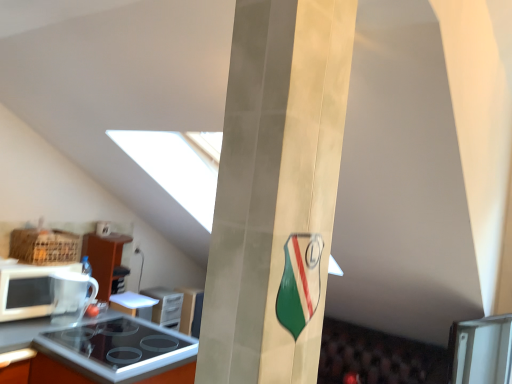
Question: Is the depth of orange laminate countertop at lower left greater than that of matte gold pillar at center?

Choices:
 (A) yes
 (B) no

Answer: (A)

Question: From a real-world perspective, is orange laminate countertop at lower left over matte gold pillar at center?

Choices:
 (A) yes
 (B) no

Answer: (B)

Question: From the image's perspective, is orange laminate countertop at lower left on matte gold pillar at center?

Choices:
 (A) yes
 (B) no

Answer: (B)

Question: Is orange laminate countertop at lower left taller than matte gold pillar at center?

Choices:
 (A) yes
 (B) no

Answer: (B)

Question: Is matte gold pillar at center completely or partially inside orange laminate countertop at lower left?

Choices:
 (A) no
 (B) yes

Answer: (A)

Question: Is matte gold pillar at center taller or shorter than orange laminate countertop at lower left?

Choices:
 (A) tall
 (B) short

Answer: (A)

Question: From a real-world perspective, is matte gold pillar at center physically located above or below orange laminate countertop at lower left?

Choices:
 (A) below
 (B) above

Answer: (B)

Question: Considering the positions of matte gold pillar at center and orange laminate countertop at lower left in the image, is matte gold pillar at center bigger or smaller than orange laminate countertop at lower left?

Choices:
 (A) big
 (B) small

Answer: (B)

Question: Considering their positions, is matte gold pillar at center located in front of or behind orange laminate countertop at lower left?

Choices:
 (A) front
 (B) behind

Answer: (A)

Question: In terms of size, does black glass stove at lower left, which is counted as the third appliance, starting from the front, appear bigger or smaller than matte gold pillar at center?

Choices:
 (A) small
 (B) big

Answer: (A)

Question: Looking at their shapes, would you say black glass stove at lower left, which is the 1th appliance from back to front, is wider or thinner than matte gold pillar at center?

Choices:
 (A) thin
 (B) wide

Answer: (B)

Question: In the image, is black glass stove at lower left, which is the 1th appliance from back to front, positioned in front of or behind matte gold pillar at center?

Choices:
 (A) front
 (B) behind

Answer: (B)

Question: Is point (147, 294) positioned closer to the camera than point (340, 46)?

Choices:
 (A) closer
 (B) farther

Answer: (B)

Question: Is black glass stove at lower left, which is counted as the third appliance, starting from the front, to the left or to the right of white glossy microwave at left in the image?

Choices:
 (A) left
 (B) right

Answer: (B)

Question: In the image, is black glass stove at lower left, which is counted as the third appliance, starting from the front, positioned in front of or behind white glossy microwave at left?

Choices:
 (A) front
 (B) behind

Answer: (B)